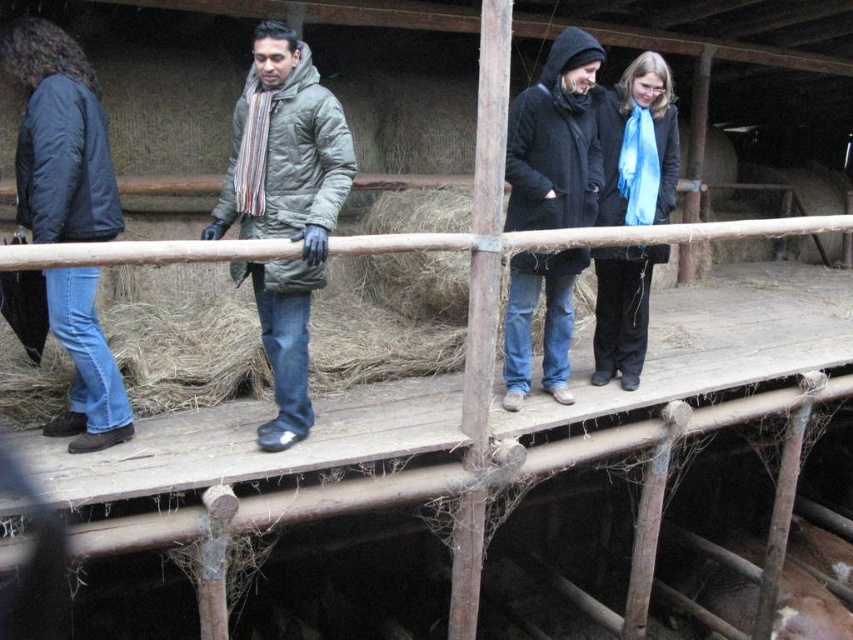
Based on the photo, between dark blue woolen coat at center and blue scarf at center, which one is positioned lower?

Positioned lower is dark blue woolen coat at center.

Which is behind, point (529, 99) or point (662, 257)?

Positioned behind is point (662, 257).

You are a GUI agent. You are given a task and a screenshot of the screen. Output one action in this format:
    pyautogui.click(x=<x>, y=<y>)
    Task: Click on the dark blue woolen coat at center
    The height and width of the screenshot is (640, 853).
    Given the screenshot: What is the action you would take?
    point(555,140)

Locate an element on the screen. This screenshot has width=853, height=640. dark blue woolen coat at center is located at coordinates (555, 140).

Who is more distant from viewer, (x=86, y=298) or (x=560, y=289)?

The point (x=560, y=289) is behind.

Image resolution: width=853 pixels, height=640 pixels. I want to click on dark blue jacket at left, so click(x=59, y=140).

Is point (19, 132) less distant than point (550, 161)?

Yes, it is.

Locate an element on the screen. dark blue jacket at left is located at coordinates (59, 140).

Consider the image. Between dark blue jacket at left and brown furry pig at lower right, which one is positioned higher?

Positioned higher is dark blue jacket at left.

Find the location of `dark blue jacket at left`. dark blue jacket at left is located at coordinates (59, 140).

The height and width of the screenshot is (640, 853). I want to click on dark blue jacket at left, so click(x=59, y=140).

This screenshot has height=640, width=853. What are the coordinates of `dark blue jacket at left` in the screenshot? It's located at (59, 140).